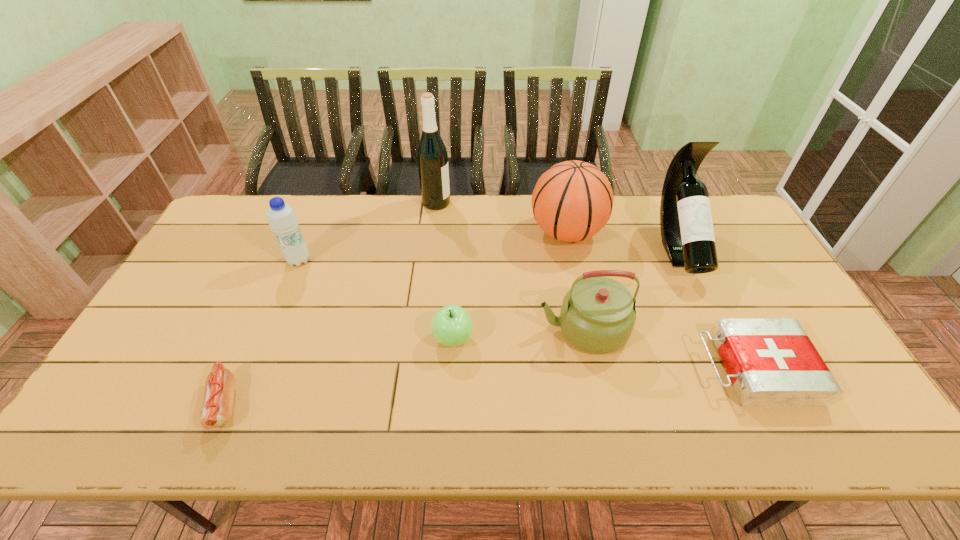
Where is `vacant space situated 0.330m on the front side of the first-aid kit`? vacant space situated 0.330m on the front side of the first-aid kit is located at coordinates (570, 369).

Image resolution: width=960 pixels, height=540 pixels. What are the coordinates of `vacant space situated 0.310m on the right of the sausage` in the screenshot? It's located at (374, 404).

At what (x,y) coordinates should I click in order to perform the action: click on basketball located in the far edge section of the desktop. Please return your answer as a coordinate pair (x, y). The image size is (960, 540). Looking at the image, I should click on (572, 201).

You are a GUI agent. You are given a task and a screenshot of the screen. Output one action in this format:
    pyautogui.click(x=<x>, y=<y>)
    Task: Click on the first-aid kit situated at the near edge
    Image resolution: width=960 pixels, height=540 pixels.
    Given the screenshot: What is the action you would take?
    pyautogui.click(x=771, y=362)

The width and height of the screenshot is (960, 540). Find the location of `sausage that is at the near edge`. sausage that is at the near edge is located at coordinates (216, 410).

The image size is (960, 540). Find the location of `object located at the right edge`. object located at the right edge is located at coordinates (771, 362).

Identify the location of object that is at the near right corner. (771, 362).

Where is `vacant space at the far edge of the desktop`? This screenshot has width=960, height=540. vacant space at the far edge of the desktop is located at coordinates (419, 194).

Where is `blank space at the near edge of the desktop`? This screenshot has height=540, width=960. blank space at the near edge of the desktop is located at coordinates (572, 441).

Where is `free space at the left edge`? This screenshot has height=540, width=960. free space at the left edge is located at coordinates (187, 287).